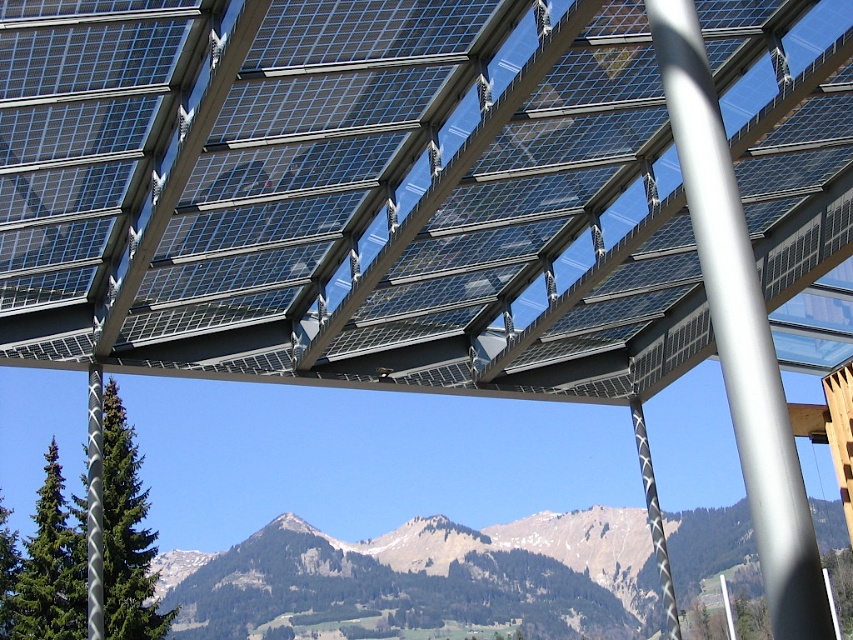
Question: Which object appears farthest from the camera in this image?

Choices:
 (A) transparent glass solar panels at center
 (B) silver metallic pole at center
 (C) rugged brown mountains at center

Answer: (C)

Question: Considering the relative positions of rugged brown mountains at center and black textured pole at center in the image provided, where is rugged brown mountains at center located with respect to black textured pole at center?

Choices:
 (A) left
 (B) right

Answer: (A)

Question: Can you confirm if transparent glass solar panels at center is positioned to the left of rugged brown mountains at center?

Choices:
 (A) yes
 (B) no

Answer: (A)

Question: Does rugged brown mountains at center appear under black textured pole at center?

Choices:
 (A) yes
 (B) no

Answer: (A)

Question: Based on their relative distances, which object is nearer to the rugged brown mountains at center?

Choices:
 (A) transparent glass solar panels at center
 (B) black textured pole at center

Answer: (B)

Question: Which point is closer to the camera?

Choices:
 (A) silver textured pole at center
 (B) silver metallic pole at center
 (C) black textured pole at center

Answer: (B)